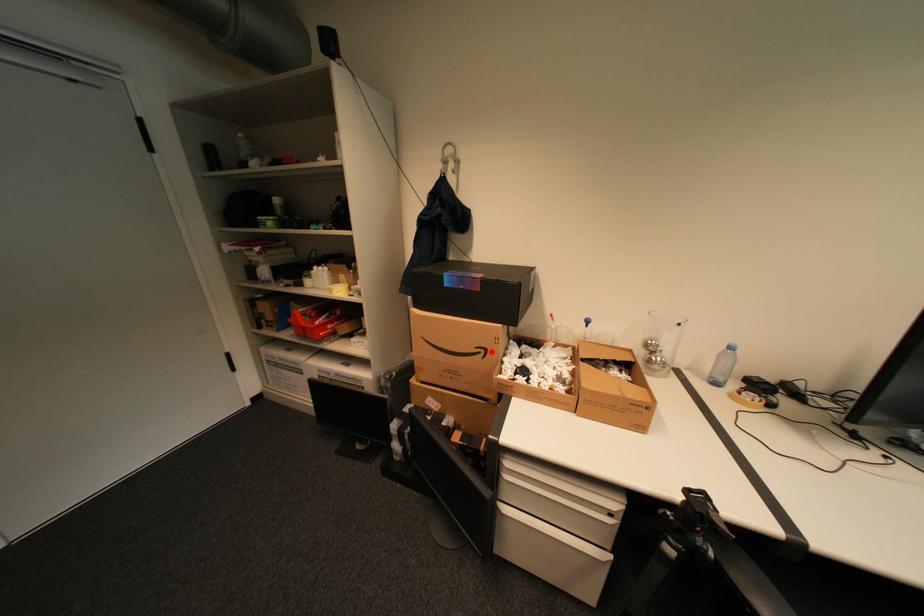
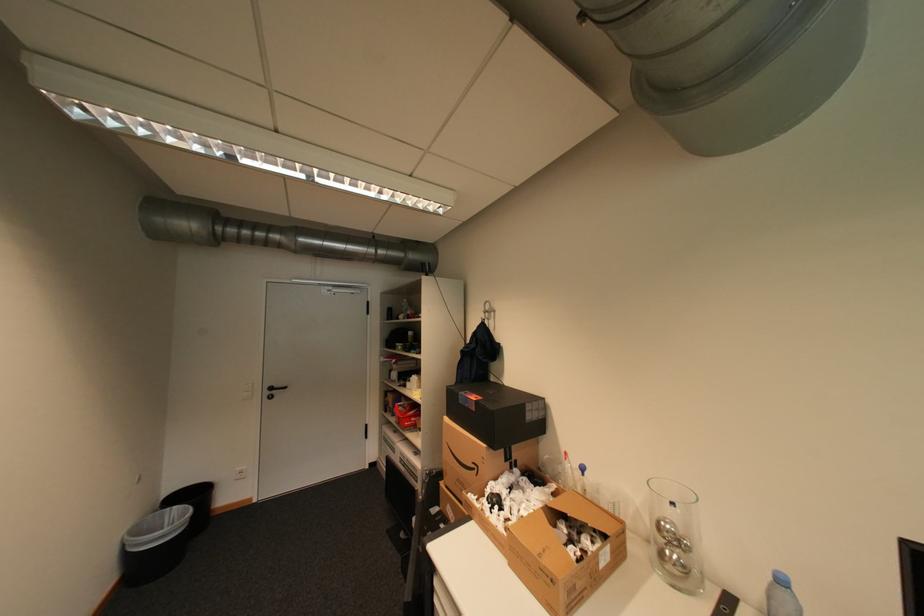
In the second image, find the point that corresponds to the highlighted location in the first image.

(484, 468)